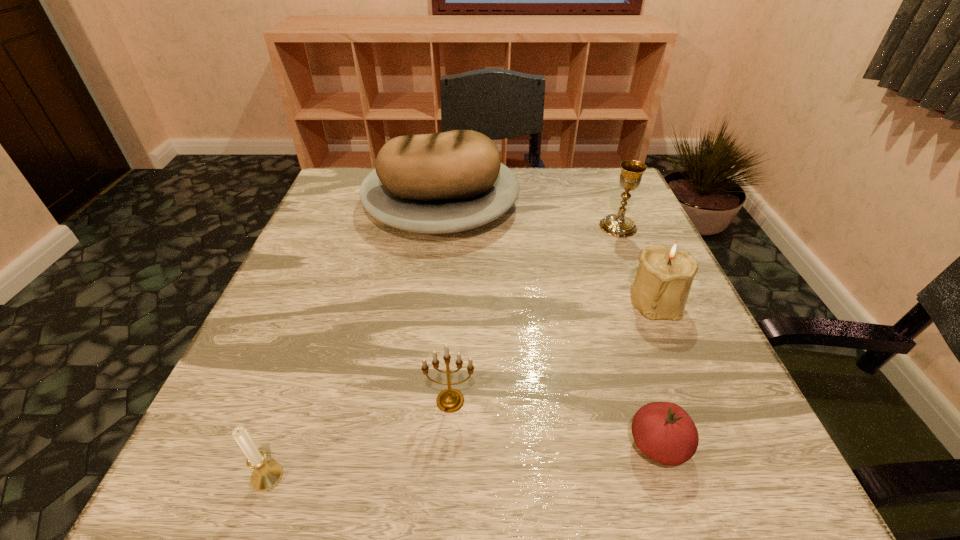
The width and height of the screenshot is (960, 540). I want to click on vacant space in between the tomato and the chalice, so click(638, 336).

Locate an element on the screen. The width and height of the screenshot is (960, 540). free point between the fourth nearest object and the nearest candle holder is located at coordinates (462, 389).

At what (x,y) coordinates should I click in order to perform the action: click on object that can be found as the fifth closest to the rightmost candle holder. Please return your answer as a coordinate pair (x, y). The image size is (960, 540). Looking at the image, I should click on (267, 474).

Locate which object is the closest to the tomato. Please provide its 2D coordinates. Your answer should be formatted as a tuple, i.e. [(x, y)], where the tuple contains the x and y coordinates of a point satisfying the conditions above.

[(665, 274)]

Choose which candle holder is the nearest neighbor to the nearest candle holder. Please provide its 2D coordinates. Your answer should be formatted as a tuple, i.e. [(x, y)], where the tuple contains the x and y coordinates of a point satisfying the conditions above.

[(450, 400)]

Image resolution: width=960 pixels, height=540 pixels. Find the location of `candle holder that is the second closest to the leftmost candle holder`. candle holder that is the second closest to the leftmost candle holder is located at coordinates (665, 274).

In order to click on vacant space that satisfies the following two spatial constraints: 1. on the front side of the chalice; 2. on the right side of the bread in this screenshot , I will do `click(439, 227)`.

Locate an element on the screen. The height and width of the screenshot is (540, 960). free spot that satisfies the following two spatial constraints: 1. on the front side of the chalice; 2. on the left side of the farthest candle holder is located at coordinates (649, 301).